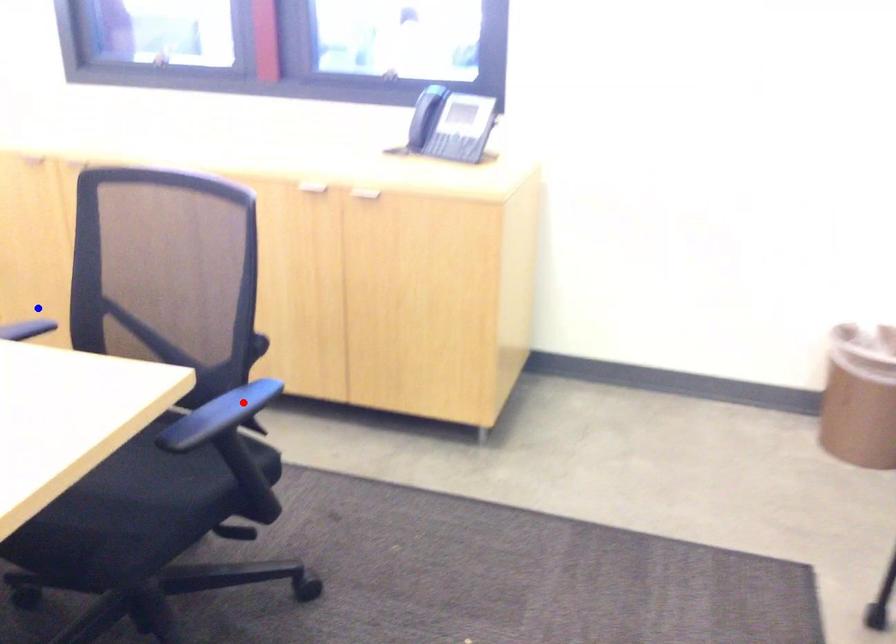
Question: Which of the two points in the image is closer to the camera?

Choices:
 (A) Blue point is closer.
 (B) Red point is closer.

Answer: (B)